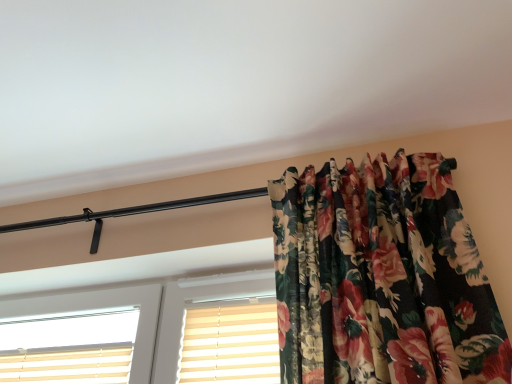
Question: Is beige striped shutter at center inside or outside of white plastic window at center?

Choices:
 (A) inside
 (B) outside

Answer: (A)

Question: In terms of size, does beige striped shutter at center appear bigger or smaller than white plastic window at center?

Choices:
 (A) small
 (B) big

Answer: (A)

Question: Does point coord(248,334) appear closer or farther from the camera than point coord(178,259)?

Choices:
 (A) closer
 (B) farther

Answer: (A)

Question: Relative to beige striped shutter at center, is white plastic window at center in front or behind?

Choices:
 (A) front
 (B) behind

Answer: (A)

Question: Is white plastic window at center situated inside beige striped shutter at center or outside?

Choices:
 (A) outside
 (B) inside

Answer: (A)

Question: Considering the positions of white plastic window at center and beige striped shutter at center in the image, is white plastic window at center taller or shorter than beige striped shutter at center?

Choices:
 (A) short
 (B) tall

Answer: (B)

Question: From a real-world perspective, is white plastic window at center physically located above or below beige striped shutter at center?

Choices:
 (A) above
 (B) below

Answer: (A)